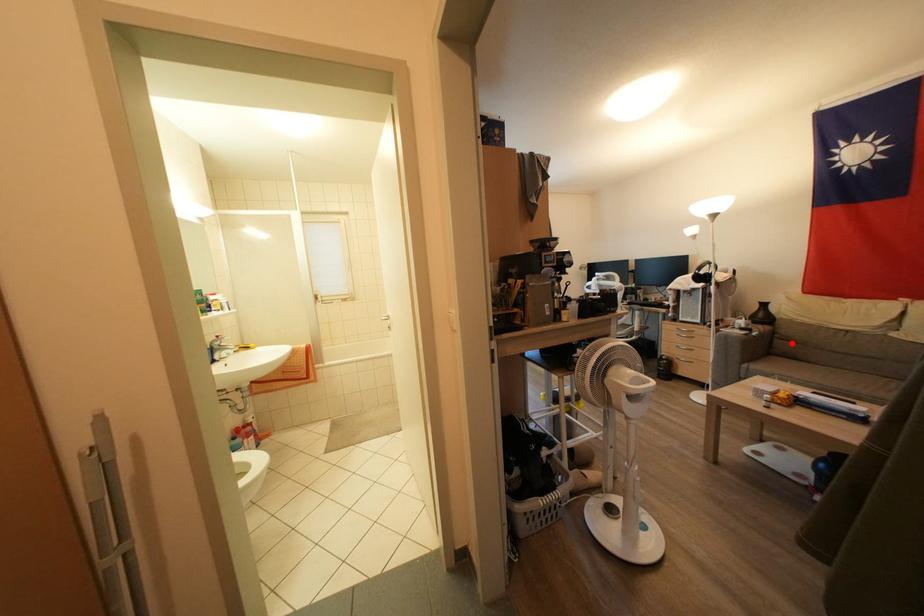
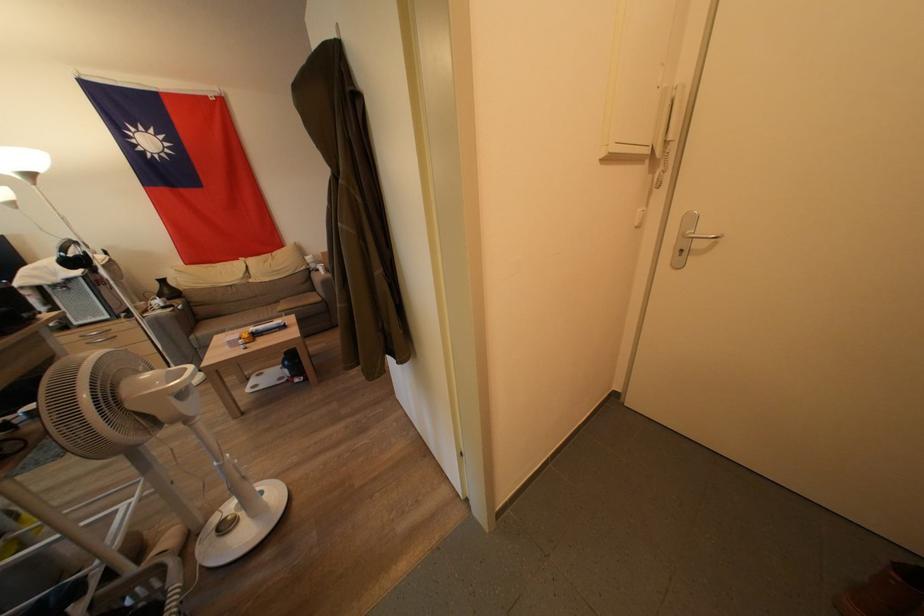
The point at the highlighted location is marked in the first image. Where is the corresponding point in the second image?

(207, 309)